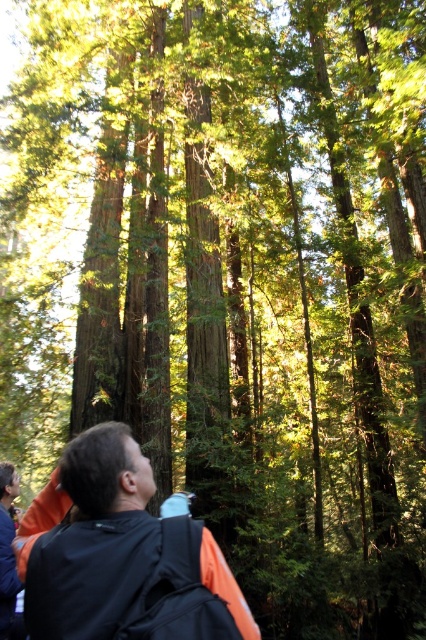
Does orange fabric backpack at lower center lie behind orange fabric jacket at lower left?

No, orange fabric backpack at lower center is closer to the viewer.

In the scene shown: Who is more distant from viewer, (141, 602) or (20, 627)?

The point (20, 627) is behind.

Between point (89, 557) and point (6, 557), which one is positioned behind?

Point (6, 557)

The image size is (426, 640). I want to click on orange fabric backpack at lower center, so click(x=120, y=554).